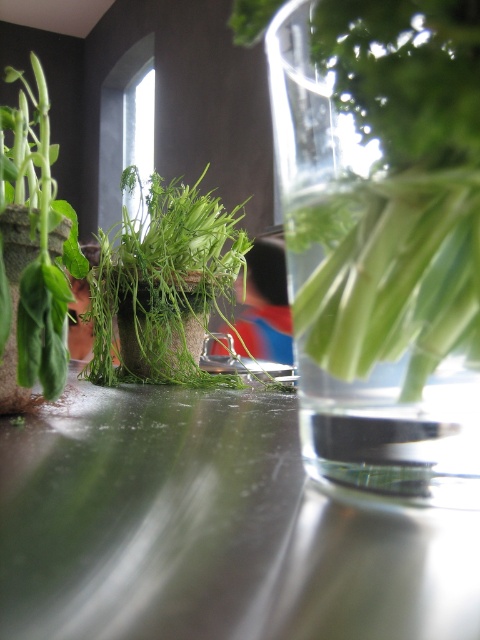
Question: From the image, what is the correct spatial relationship of green leafy plant at center in relation to green matte plant at left?

Choices:
 (A) left
 (B) right

Answer: (B)

Question: Which object is farther from the camera taking this photo?

Choices:
 (A) green matte plant at left
 (B) clear glass vase at center
 (C) green leafy plant at center
 (D) shiny metallic table at center

Answer: (C)

Question: Which object is closer to the camera taking this photo?

Choices:
 (A) green matte plant at left
 (B) shiny metallic table at center
 (C) green leafy plant at center
 (D) clear glass vase at center

Answer: (B)

Question: Does green leafy plant at center lie behind green matte plant at left?

Choices:
 (A) yes
 (B) no

Answer: (A)

Question: Can you confirm if clear glass vase at center is positioned above green matte plant pot at left?

Choices:
 (A) yes
 (B) no

Answer: (A)

Question: Which point is closer to the camera taking this photo?

Choices:
 (A) (442, 432)
 (B) (134, 272)
 (C) (80, 252)
 (D) (14, 307)

Answer: (A)